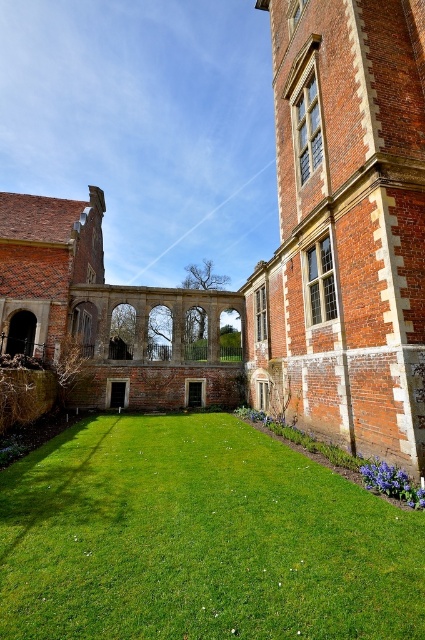
How far apart are green grass at center and brick wall at right?

green grass at center is 6.53 meters away from brick wall at right.

Does green grass at center appear over brick wall at right?

Actually, green grass at center is below brick wall at right.

Which is in front, point (328, 572) or point (254, 307)?

Positioned in front is point (328, 572).

Locate an element on the screen. This screenshot has width=425, height=640. green grass at center is located at coordinates (198, 540).

Is brick wall at right to the left of red brick arches at center from the viewer's perspective?

In fact, brick wall at right is to the right of red brick arches at center.

Is point (291, 138) more distant than point (122, 388)?

No, it is not.

Identify the location of brick wall at right. (345, 227).

Locate an element on the screen. This screenshot has width=425, height=640. green grass at center is located at coordinates (198, 540).

Find the location of a particular element. The width and height of the screenshot is (425, 640). green grass at center is located at coordinates (198, 540).